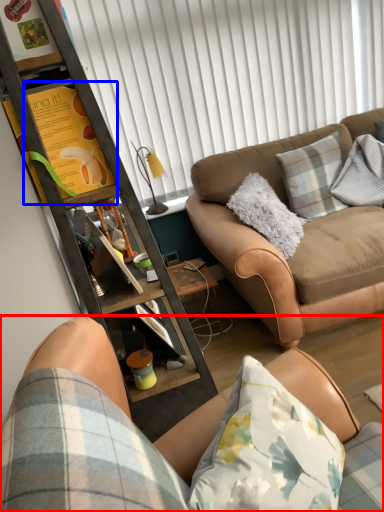
Question: Which of the following is the closest to the observer, studio couch (highlighted by a red box) or bulletin board (highlighted by a blue box)?

Choices:
 (A) studio couch
 (B) bulletin board

Answer: (A)